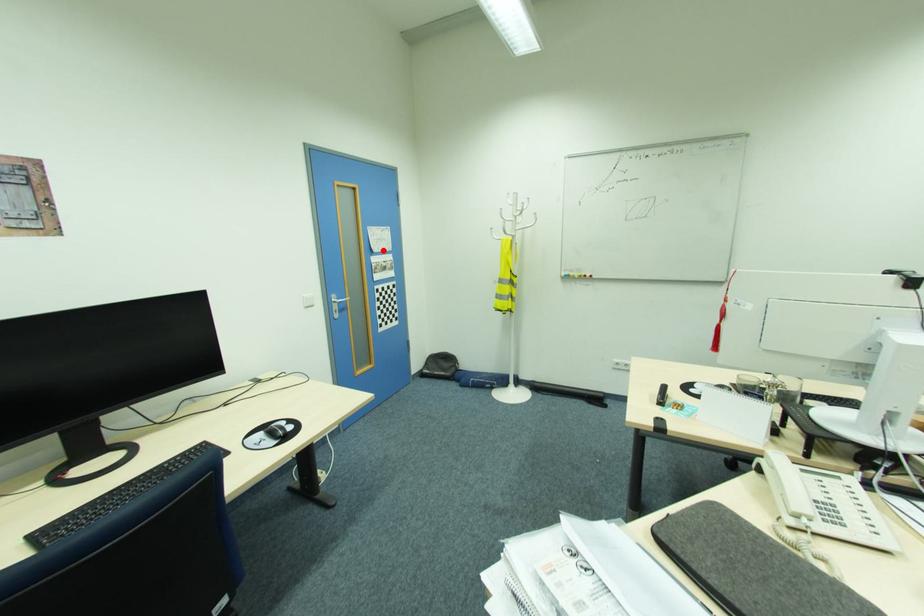
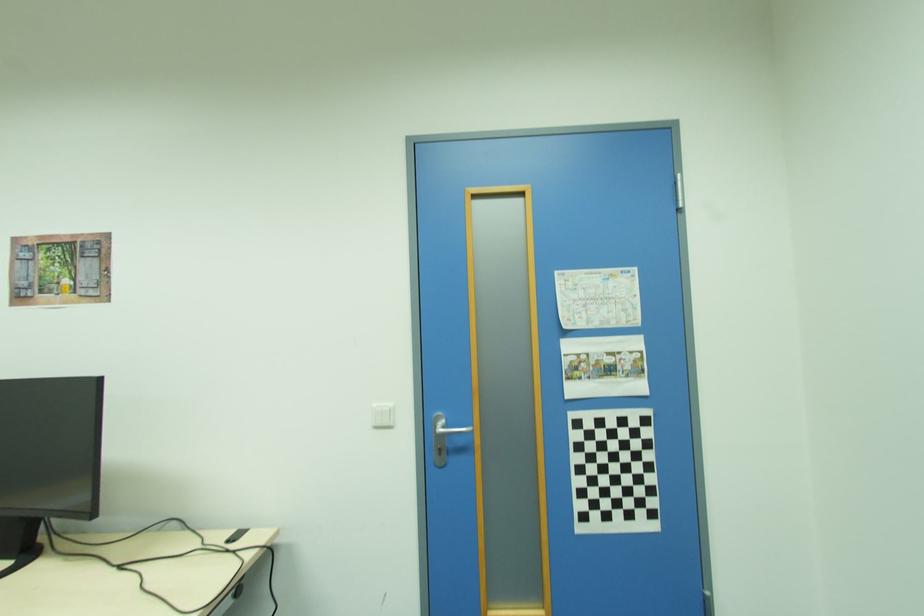
Where in the second image is the point corresponding to the highlighted location from the first image?

(599, 325)